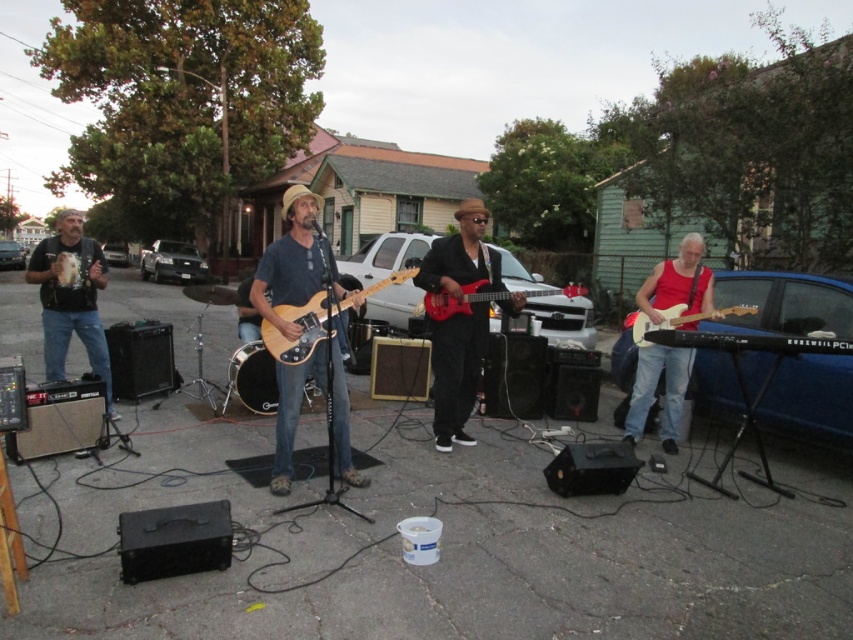
Is red matte guitar at right further to the viewer compared to matte wood electric guitar at right?

Yes, it is behind matte wood electric guitar at right.

Find the location of `red matte guitar at right`. red matte guitar at right is located at coordinates (654, 390).

The height and width of the screenshot is (640, 853). Describe the element at coordinates (654, 390) in the screenshot. I see `red matte guitar at right` at that location.

Identify the location of red matte guitar at right. (654, 390).

Can you confirm if shiny red electric guitar at center is bigger than matte black guitar at left?

No.

Between shiny red electric guitar at center and matte black guitar at left, which one appears on the left side from the viewer's perspective?

matte black guitar at left

Between point (456, 253) and point (86, 344), which one is positioned in front?

Point (456, 253) is in front.

Identify the location of shiny red electric guitar at center. This screenshot has width=853, height=640. (456, 372).

Is point (471, 259) closer to viewer compared to point (486, 280)?

Yes.

Does shiny red electric guitar at center come in front of glossy electric guitar at center?

Yes, shiny red electric guitar at center is closer to the viewer.

This screenshot has height=640, width=853. What are the coordinates of `shiny red electric guitar at center` in the screenshot? It's located at (456, 372).

Where is `shiny red electric guitar at center`? This screenshot has width=853, height=640. shiny red electric guitar at center is located at coordinates (456, 372).